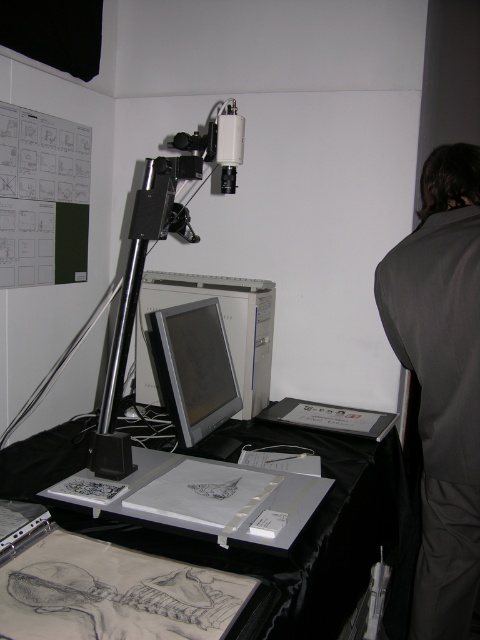
Between metallic gray table at center and matte silver monitor at center, which one is positioned higher?

matte silver monitor at center

Who is shorter, metallic gray table at center or matte silver monitor at center?

With less height is matte silver monitor at center.

Identify the location of metallic gray table at center. The width and height of the screenshot is (480, 640). (302, 529).

At what (x,y) coordinates should I click in order to perform the action: click on metallic gray table at center. Please return your answer as a coordinate pair (x, y). Looking at the image, I should click on (302, 529).

Is dark gray fabric at right shorter than metallic gray table at center?

Incorrect, dark gray fabric at right's height does not fall short of metallic gray table at center's.

This screenshot has height=640, width=480. Find the location of `dark gray fabric at right`. dark gray fabric at right is located at coordinates click(x=442, y=380).

Identify the location of dark gray fabric at right. (442, 380).

Is dark gray fabric at right taller than matte silver monitor at center?

Correct, dark gray fabric at right is much taller as matte silver monitor at center.

Is point (444, 499) positioned before point (200, 321)?

Yes, it is in front of point (200, 321).

Locate an element on the screen. The width and height of the screenshot is (480, 640). dark gray fabric at right is located at coordinates (442, 380).